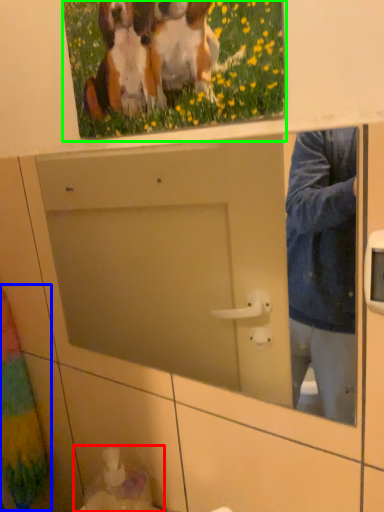
Question: Which object is the closest to the sink (highlighted by a red box)? Choose among these: curtain (highlighted by a blue box) or picture frame (highlighted by a green box).

Choices:
 (A) curtain
 (B) picture frame

Answer: (A)